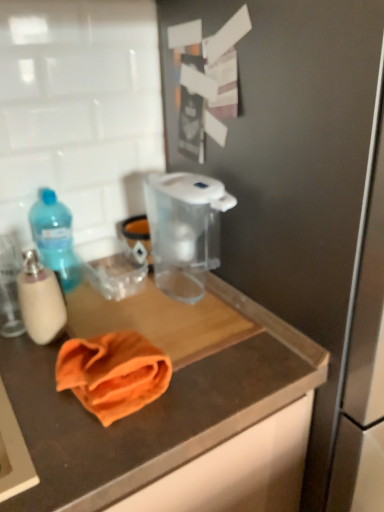
Question: From the image's perspective, is blue translucent bottle at left, the first bottle when ordered from back to front, positioned above or below transparent plastic pitcher at center?

Choices:
 (A) below
 (B) above

Answer: (A)

Question: Based on their positions, is blue translucent bottle at left, the first bottle when ordered from back to front, located to the left or right of transparent plastic pitcher at center?

Choices:
 (A) left
 (B) right

Answer: (A)

Question: Estimate the real-world distances between objects in this image. Which object is farther from the blue translucent bottle at left, the first bottle when ordered from back to front?

Choices:
 (A) translucent plastic soap dispenser at left, which appears as the second bottle when viewed from the back
 (B) transparent plastic pitcher at center
 (C) orange cloth at center

Answer: (C)

Question: Which object is the farthest from the orange cloth at center?

Choices:
 (A) blue translucent bottle at left, the first bottle when ordered from back to front
 (B) transparent plastic pitcher at center
 (C) translucent plastic soap dispenser at left, acting as the 1th bottle starting from the front

Answer: (A)